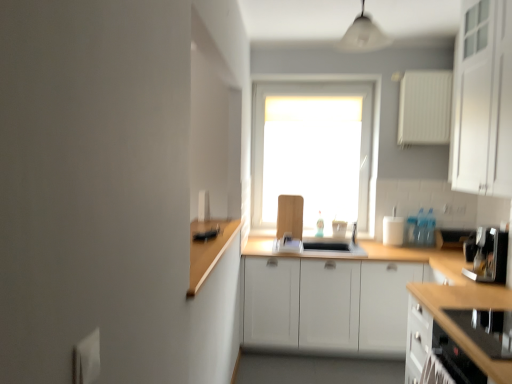
Question: Can you confirm if white matte cabinet at upper right, which ranks as the first cabinetry in top-to-bottom order, is positioned to the left of white matte window at center?

Choices:
 (A) yes
 (B) no

Answer: (B)

Question: Is white matte cabinet at upper right, which ranks as the first cabinetry in top-to-bottom order, positioned far away from white matte window at center?

Choices:
 (A) yes
 (B) no

Answer: (A)

Question: Considering the relative sizes of white matte cabinet at upper right, which ranks as the first cabinetry in top-to-bottom order, and white matte window at center in the image provided, is white matte cabinet at upper right, which ranks as the first cabinetry in top-to-bottom order, shorter than white matte window at center?

Choices:
 (A) no
 (B) yes

Answer: (B)

Question: From a real-world perspective, is white matte cabinet at upper right, acting as the 2th cabinetry starting from the bottom, below white matte window at center?

Choices:
 (A) yes
 (B) no

Answer: (B)

Question: Considering the relative sizes of white matte cabinet at upper right, which ranks as the first cabinetry in top-to-bottom order, and white matte window at center in the image provided, is white matte cabinet at upper right, which ranks as the first cabinetry in top-to-bottom order, wider than white matte window at center?

Choices:
 (A) yes
 (B) no

Answer: (A)

Question: Considering the positions of wooden at center and black glass stovetop at lower right, the 2th cabinetry when ordered from top to bottom, in the image, is wooden at center wider or thinner than black glass stovetop at lower right, the 2th cabinetry when ordered from top to bottom,?

Choices:
 (A) thin
 (B) wide

Answer: (B)

Question: In the image, is wooden at center positioned in front of or behind black glass stovetop at lower right, the 2th cabinetry when ordered from top to bottom?

Choices:
 (A) behind
 (B) front

Answer: (A)

Question: Looking at the image, does wooden at center seem bigger or smaller compared to black glass stovetop at lower right, the 2th cabinetry when ordered from top to bottom?

Choices:
 (A) big
 (B) small

Answer: (A)

Question: Would you say wooden at center is to the left or to the right of black glass stovetop at lower right, marked as the first cabinetry in a bottom-to-top arrangement, in the picture?

Choices:
 (A) right
 (B) left

Answer: (B)

Question: Considering the positions of black glass stovetop at lower right, marked as the first cabinetry in a bottom-to-top arrangement, and white matte cabinet at upper right, acting as the 2th cabinetry starting from the bottom, in the image, is black glass stovetop at lower right, marked as the first cabinetry in a bottom-to-top arrangement, taller or shorter than white matte cabinet at upper right, acting as the 2th cabinetry starting from the bottom,?

Choices:
 (A) short
 (B) tall

Answer: (A)

Question: In the image, is black glass stovetop at lower right, the 2th cabinetry when ordered from top to bottom, positioned in front of or behind white matte cabinet at upper right, acting as the 2th cabinetry starting from the bottom?

Choices:
 (A) behind
 (B) front

Answer: (B)

Question: Looking at their shapes, would you say black glass stovetop at lower right, marked as the first cabinetry in a bottom-to-top arrangement, is wider or thinner than white matte cabinet at upper right, acting as the 2th cabinetry starting from the bottom?

Choices:
 (A) thin
 (B) wide

Answer: (B)

Question: Is black glass stovetop at lower right, the 2th cabinetry when ordered from top to bottom, inside the boundaries of white matte cabinet at upper right, which ranks as the first cabinetry in top-to-bottom order, or outside?

Choices:
 (A) inside
 (B) outside

Answer: (B)

Question: From a real-world perspective, is white matte cabinet at upper right, acting as the 2th cabinetry starting from the bottom, positioned above or below white glossy light fixture at upper center?

Choices:
 (A) above
 (B) below

Answer: (B)

Question: In the image, is white matte cabinet at upper right, acting as the 2th cabinetry starting from the bottom, positioned in front of or behind white glossy light fixture at upper center?

Choices:
 (A) front
 (B) behind

Answer: (A)